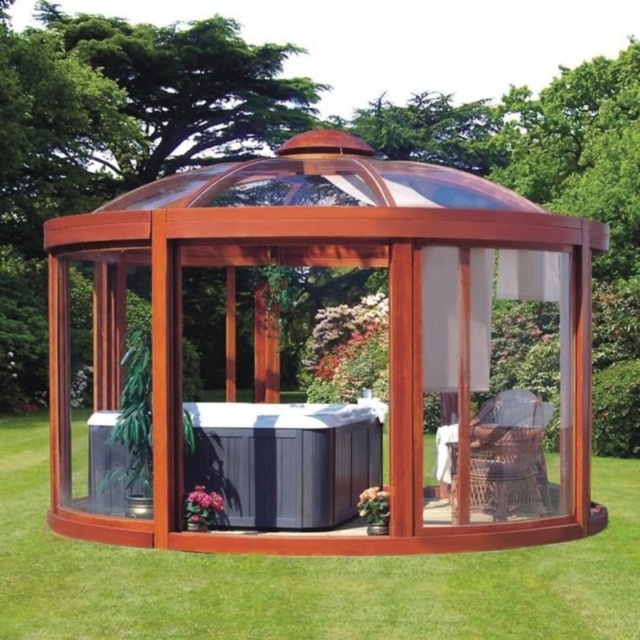
You are planning to place a 36 inch wide decorative bench in the garden. The wooden gazebo at center and green grass at center are two areas you are considering. Based on the space between them, can the bench fit between the two areas?

The wooden gazebo at center and green grass at center are 34.21 inches apart. Since the bench is 36 inches wide, it cannot fit between them as the space is narrower than the bench.

You are standing in the garden and want to locate the wooden gazebo at center. According to the coordinates provided, where should you look?

The wooden gazebo at center is located at coordinates point (388, 323).